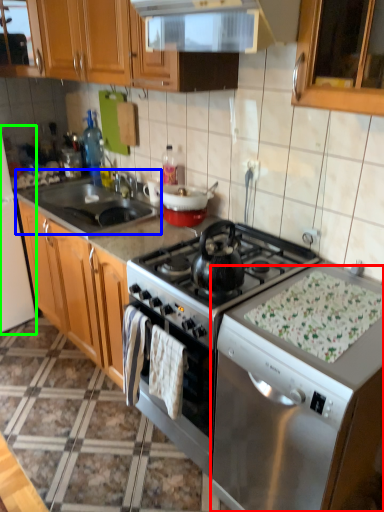
Question: Which object is positioned farthest from dish washer (highlighted by a red box)? Select from sink (highlighted by a blue box) and appliance (highlighted by a green box).

Choices:
 (A) sink
 (B) appliance

Answer: (B)